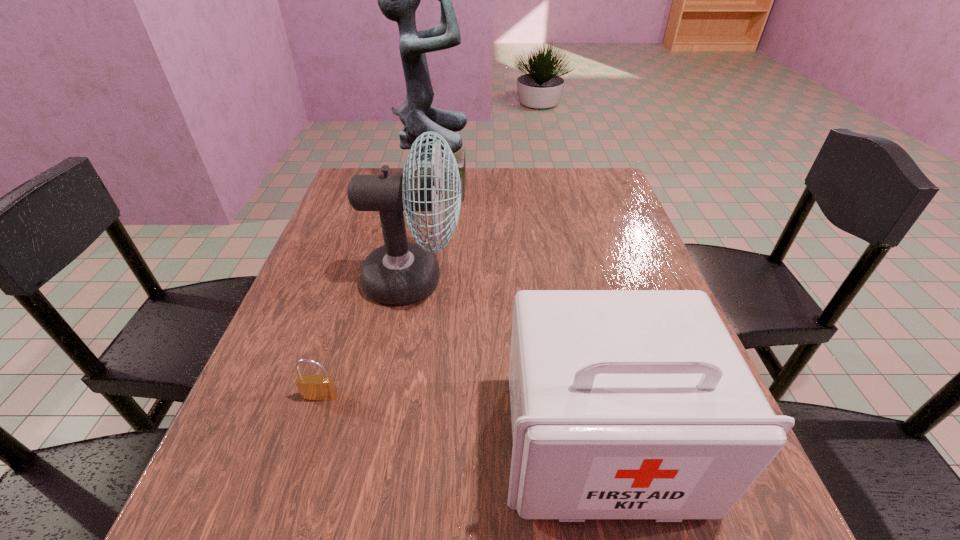
What are the coordinates of `object that is positioned at the far edge` in the screenshot? It's located at (398, 0).

Where is `object at the near edge`? Image resolution: width=960 pixels, height=540 pixels. object at the near edge is located at coordinates (625, 404).

Identify the location of fan at the left edge. Image resolution: width=960 pixels, height=540 pixels. (399, 272).

Identify the location of padlock located in the left edge section of the desktop. This screenshot has height=540, width=960. (311, 387).

Where is `object positioned at the right edge`? The image size is (960, 540). object positioned at the right edge is located at coordinates (625, 404).

This screenshot has width=960, height=540. Find the location of `object at the near right corner`. object at the near right corner is located at coordinates (625, 404).

Identify the location of free space at the far edge. (554, 178).

At what (x,y) coordinates should I click in order to perform the action: click on vacant space at the near edge of the desktop. Please return your answer as a coordinate pair (x, y). The width and height of the screenshot is (960, 540). Looking at the image, I should click on (324, 516).

Identify the location of free location at the left edge. (327, 230).

Identify the location of free location at the right edge. (627, 241).